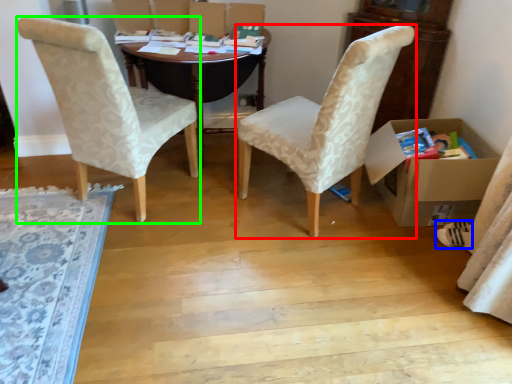
Question: Based on their relative distances, which object is farther from chair (highlighted by a red box)? Choose from footwear (highlighted by a blue box) and chair (highlighted by a green box).

Choices:
 (A) footwear
 (B) chair

Answer: (A)